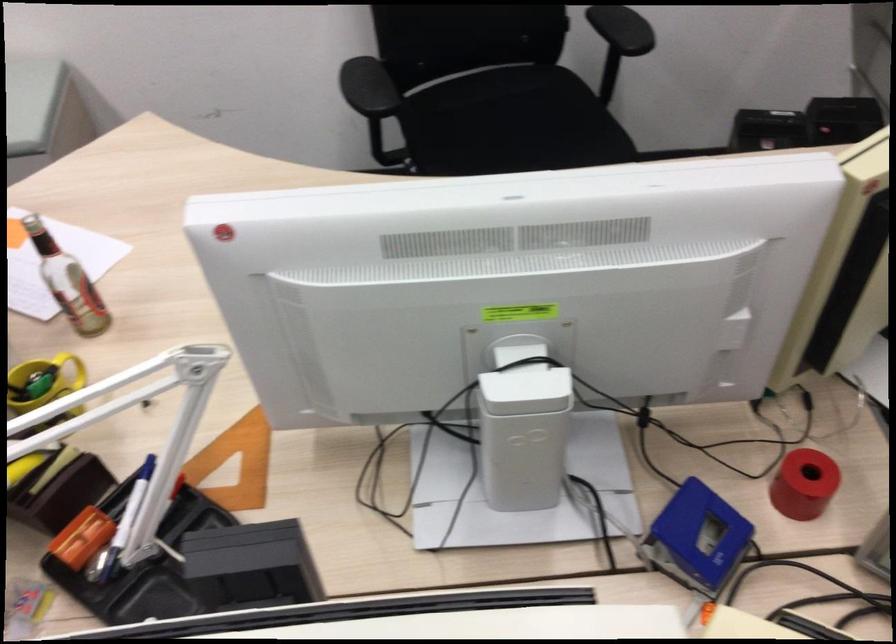
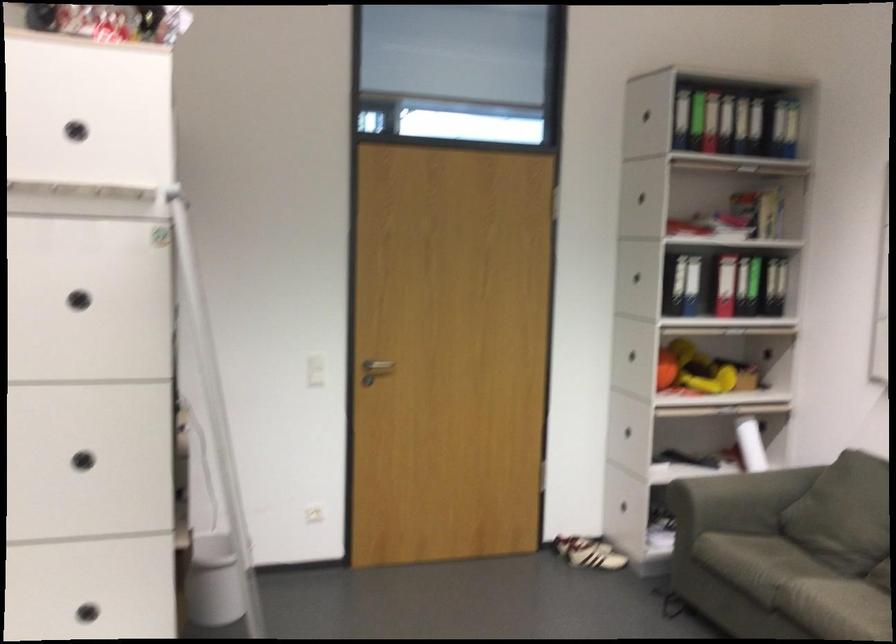
Question: The camera is either moving clockwise (left) or counter-clockwise (right) around the object. The first image is from the beginning of the video and the second image is from the end. Is the camera moving left or right when shooting the video?

Choices:
 (A) Left
 (B) Right

Answer: (B)